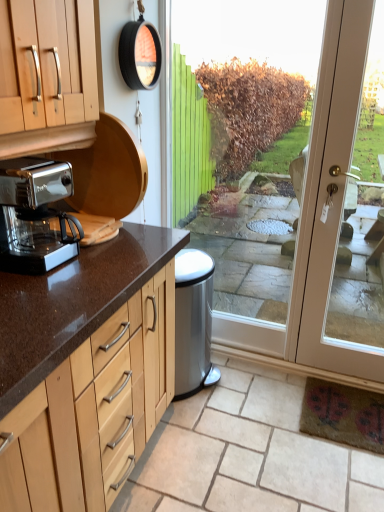
Question: Considering the positions of light brown wood at lower left and metallic glass coffee maker at left in the image, is light brown wood at lower left bigger or smaller than metallic glass coffee maker at left?

Choices:
 (A) big
 (B) small

Answer: (A)

Question: Based on their positions, is light brown wood at lower left located to the left or right of metallic glass coffee maker at left?

Choices:
 (A) left
 (B) right

Answer: (B)

Question: Estimate the real-world distances between objects in this image. Which object is closer to the transparent glass door at center?

Choices:
 (A) white glossy door at right
 (B) metallic glass coffee maker at left
 (C) light brown wood at lower left

Answer: (A)

Question: Based on their relative distances, which object is farther from the metallic glass coffee maker at left?

Choices:
 (A) light brown wood at lower left
 (B) transparent glass door at center
 (C) white glossy door at right

Answer: (B)